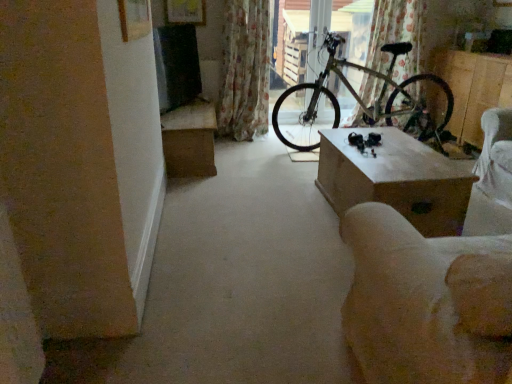
Question: From the image's perspective, is metallic bicycle at center on wooden box at right?

Choices:
 (A) no
 (B) yes

Answer: (B)

Question: Does metallic bicycle at center have a smaller size compared to wooden box at right?

Choices:
 (A) yes
 (B) no

Answer: (A)

Question: Is metallic bicycle at center far away from wooden box at right?

Choices:
 (A) yes
 (B) no

Answer: (A)

Question: Considering the relative sizes of metallic bicycle at center and wooden box at right in the image provided, is metallic bicycle at center bigger than wooden box at right?

Choices:
 (A) yes
 (B) no

Answer: (B)

Question: From a real-world perspective, is metallic bicycle at center on wooden box at right?

Choices:
 (A) yes
 (B) no

Answer: (A)

Question: From their relative heights in the image, would you say floral fabric curtain at upper center, the second curtain from the left, is taller or shorter than wooden box at right?

Choices:
 (A) short
 (B) tall

Answer: (B)

Question: From a real-world perspective, is floral fabric curtain at upper center, the second curtain from the left, positioned above or below wooden box at right?

Choices:
 (A) above
 (B) below

Answer: (A)

Question: Is floral fabric curtain at upper center, the first curtain positioned from the right, wider or thinner than wooden box at right?

Choices:
 (A) wide
 (B) thin

Answer: (B)

Question: From the image's perspective, is floral fabric curtain at upper center, the second curtain from the left, located above or below wooden box at right?

Choices:
 (A) below
 (B) above

Answer: (B)

Question: Is point (444, 312) closer or farther from the camera than point (254, 86)?

Choices:
 (A) closer
 (B) farther

Answer: (A)

Question: Based on their sizes in the image, would you say beige fabric armchair at lower right is bigger or smaller than floral fabric curtain at center, marked as the 2th curtain in a right-to-left arrangement?

Choices:
 (A) big
 (B) small

Answer: (A)

Question: Considering the positions of beige fabric armchair at lower right and floral fabric curtain at center, marked as the first curtain in a left-to-right arrangement, in the image, is beige fabric armchair at lower right wider or thinner than floral fabric curtain at center, marked as the first curtain in a left-to-right arrangement,?

Choices:
 (A) wide
 (B) thin

Answer: (A)

Question: From a real-world perspective, is beige fabric armchair at lower right positioned above or below floral fabric curtain at center, marked as the 2th curtain in a right-to-left arrangement?

Choices:
 (A) below
 (B) above

Answer: (A)

Question: Considering the positions of metallic bicycle at center and beige fabric armchair at lower right in the image, is metallic bicycle at center bigger or smaller than beige fabric armchair at lower right?

Choices:
 (A) small
 (B) big

Answer: (A)

Question: Considering the positions of metallic bicycle at center and beige fabric armchair at lower right in the image, is metallic bicycle at center taller or shorter than beige fabric armchair at lower right?

Choices:
 (A) tall
 (B) short

Answer: (A)